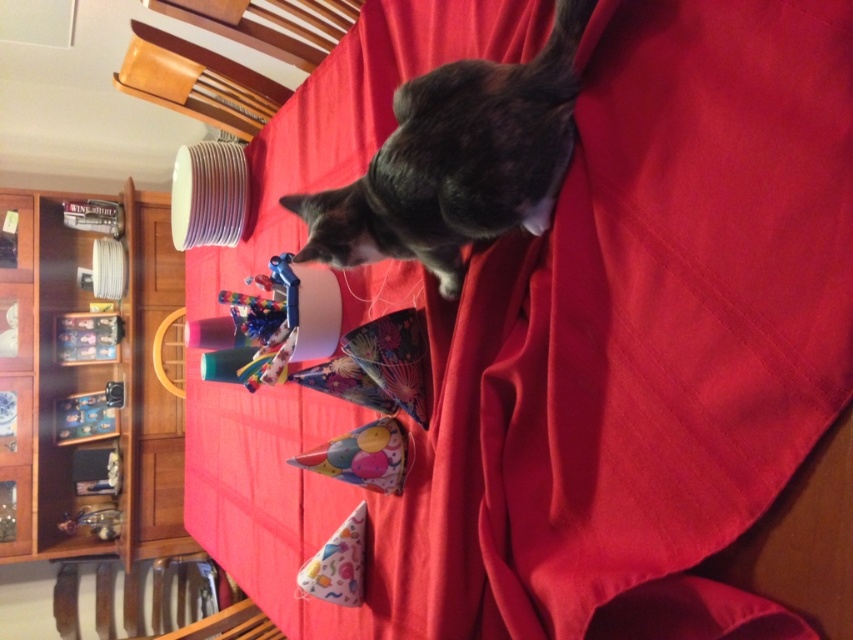
You are planning to stack the multicolored paper party hat at center and the patterned paper party hat at lower center on top of each other. Which one should you place at the bottom to ensure stability?

The multicolored paper party hat at center has a lesser height compared to the patterned paper party hat at lower center, so placing the taller patterned paper party hat at lower center at the bottom will provide better stability.

You are a guest at a party and see the dark gray fur cat at upper center and the patterned paper party hat at lower center on the table. Which object is closer to you from your viewpoint?

The dark gray fur cat at upper center is positioned over the patterned paper party hat at lower center, so the cat is closer to you.

You are a guest at a party and see the dark gray fur cat at upper center and the metallic plastic toy at left on the table. Which object is taller?

The dark gray fur cat at upper center is much taller than the metallic plastic toy at left.